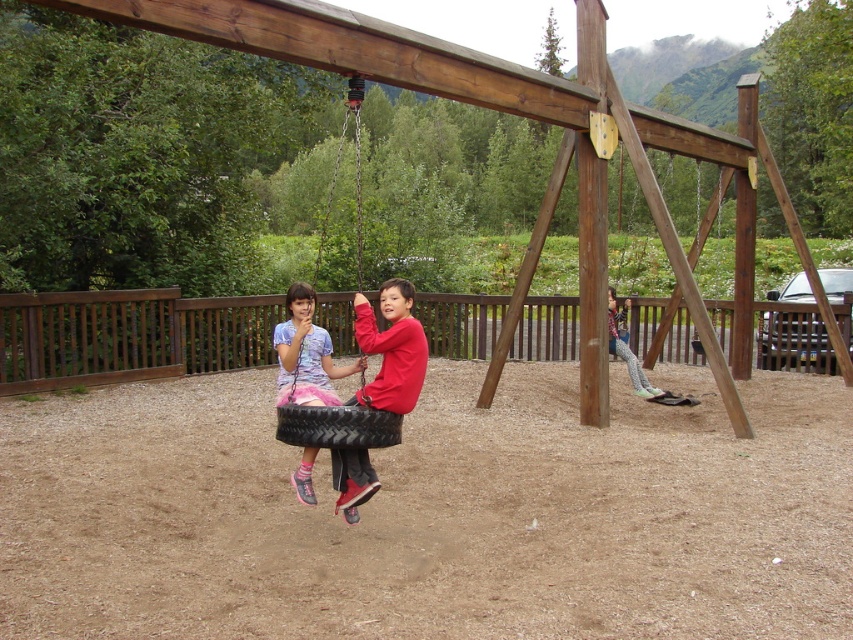
You are a parent trying to decide which swing to let your child use. The black rubber tire swing at center and the black rubber tire at center are both available. Which one is taller?

The black rubber tire swing at center is taller than the black rubber tire at center.

You want to sit on the swing that has more space for your legs. Which swing should you choose between the matte pink fabric tire swing at center and the black rubber tire swing at center?

The black rubber tire swing at center has a greater width than the matte pink fabric tire swing at center, so you should choose the black rubber tire swing at center for more leg space.